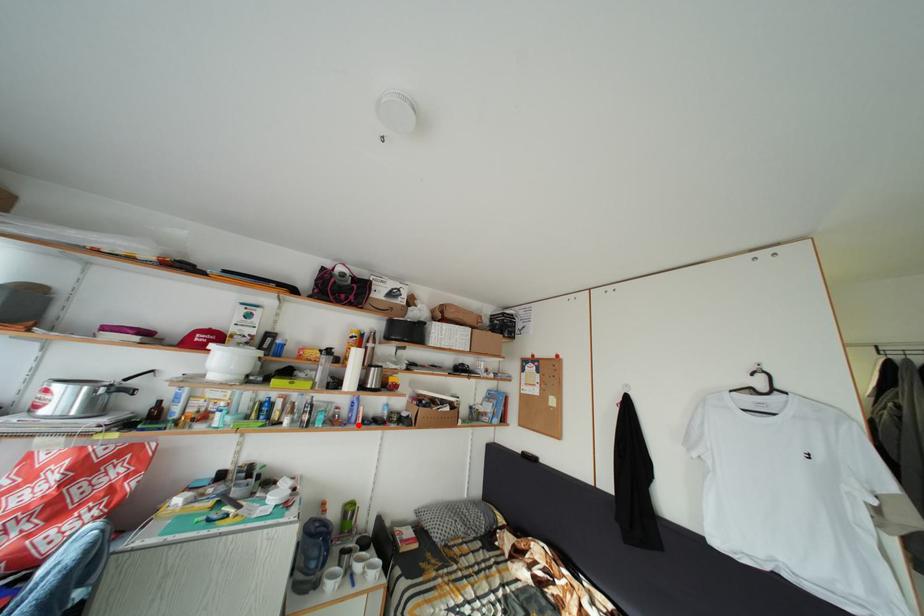
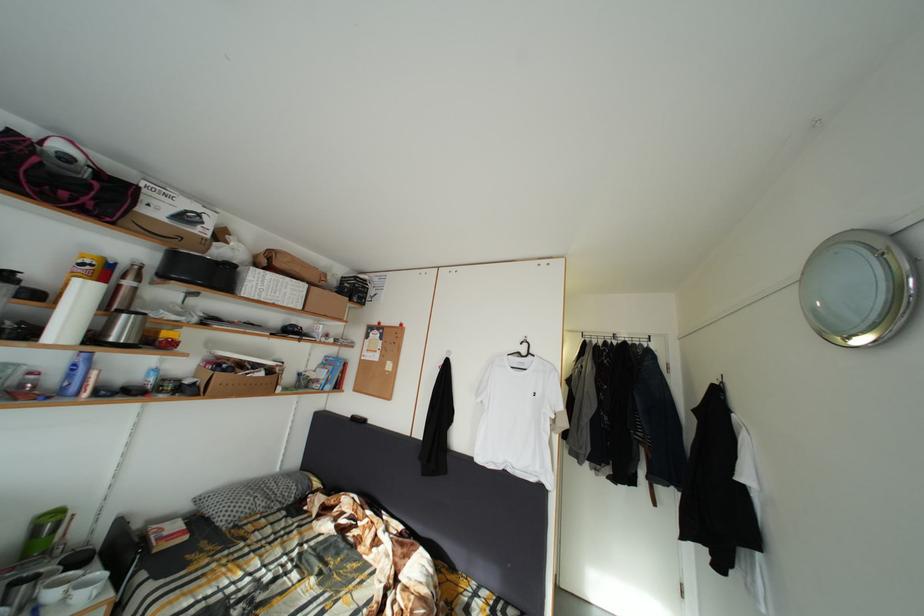
Question: I am providing you with two images of the same scene from different viewpoints. In image1, a red point is highlighted. Considering the same 3D point in image2, which of the following is correct?

Choices:
 (A) It is closer
 (B) It is farther

Answer: (A)